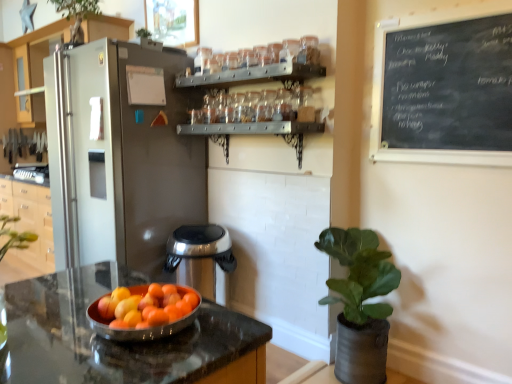
Identify the location of free space in front of shiny metallic bowl at center. (119, 362).